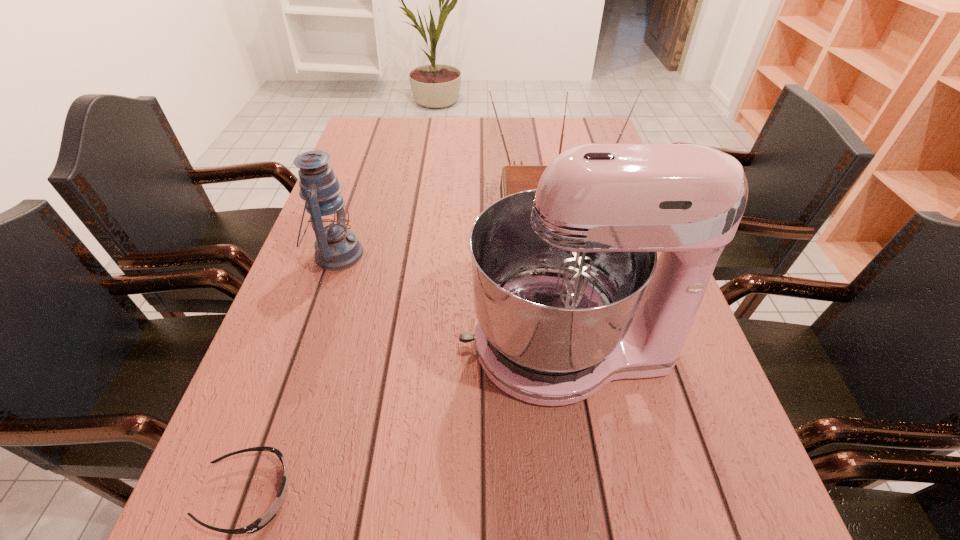
Identify the location of free space located on the front-facing side of the lantern. The width and height of the screenshot is (960, 540). (472, 254).

This screenshot has width=960, height=540. In order to click on free spot located 0.300m on the lenses of the shortest object in this screenshot , I will do `click(491, 495)`.

The image size is (960, 540). I want to click on object positioned at the near edge, so click(x=260, y=523).

The width and height of the screenshot is (960, 540). What are the coordinates of `lantern situated at the left edge` in the screenshot? It's located at (336, 248).

Find the location of a particular element. Image resolution: width=960 pixels, height=540 pixels. sunglasses situated at the left edge is located at coordinates (x=260, y=523).

I want to click on mixer that is positioned at the right edge, so click(569, 295).

I want to click on radio_receiver at the right edge, so click(515, 178).

This screenshot has height=540, width=960. Identify the location of object present at the near left corner. (260, 523).

You are a GUI agent. You are given a task and a screenshot of the screen. Output one action in this format:
    pyautogui.click(x=<x>, y=<y>)
    Task: Click on the vacant space at the far edge of the desktop
    This screenshot has width=960, height=540.
    Given the screenshot: What is the action you would take?
    pyautogui.click(x=546, y=136)

You are a GUI agent. You are given a task and a screenshot of the screen. Output one action in this format:
    pyautogui.click(x=<x>, y=<y>)
    Task: Click on the vacant region at the left edge of the desktop
    Image resolution: width=960 pixels, height=540 pixels.
    Given the screenshot: What is the action you would take?
    pyautogui.click(x=344, y=318)